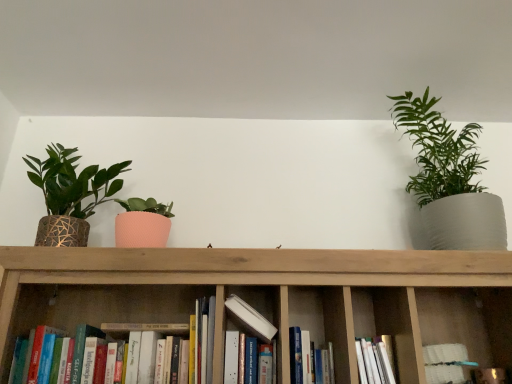
Question: Are wooden bookshelf at center and hardcover books at center, which is counted as the 1th book, starting from the left, far apart?

Choices:
 (A) no
 (B) yes

Answer: (A)

Question: Is the position of wooden bookshelf at center less distant than that of hardcover books at center, which is counted as the 1th book, starting from the left?

Choices:
 (A) yes
 (B) no

Answer: (A)

Question: From the image's perspective, is wooden bookshelf at center under hardcover books at center, which is counted as the 1th book, starting from the left?

Choices:
 (A) yes
 (B) no

Answer: (A)

Question: Does wooden bookshelf at center have a smaller size compared to hardcover books at center, the fourth book from the right?

Choices:
 (A) yes
 (B) no

Answer: (A)

Question: Does wooden bookshelf at center appear on the left side of hardcover books at center, which is counted as the 1th book, starting from the left?

Choices:
 (A) yes
 (B) no

Answer: (B)

Question: Is wooden bookshelf at center behind hardcover books at center, the fourth book from the right?

Choices:
 (A) no
 (B) yes

Answer: (A)

Question: Is wooden bookshelf at center positioned behind wooden bookshelf at center?

Choices:
 (A) no
 (B) yes

Answer: (B)

Question: Is wooden bookshelf at center bigger than wooden bookshelf at center?

Choices:
 (A) yes
 (B) no

Answer: (B)

Question: From the image's perspective, is wooden bookshelf at center on top of wooden bookshelf at center?

Choices:
 (A) no
 (B) yes

Answer: (A)

Question: Is wooden bookshelf at center positioned in front of wooden bookshelf at center?

Choices:
 (A) yes
 (B) no

Answer: (B)

Question: Is wooden bookshelf at center with wooden bookshelf at center?

Choices:
 (A) no
 (B) yes

Answer: (A)

Question: Is wooden bookshelf at center wider than wooden bookshelf at center?

Choices:
 (A) no
 (B) yes

Answer: (A)

Question: Does wooden bookshelf at center have a lesser width compared to white matte book at center, which is the 2th book in left-to-right order?

Choices:
 (A) yes
 (B) no

Answer: (B)